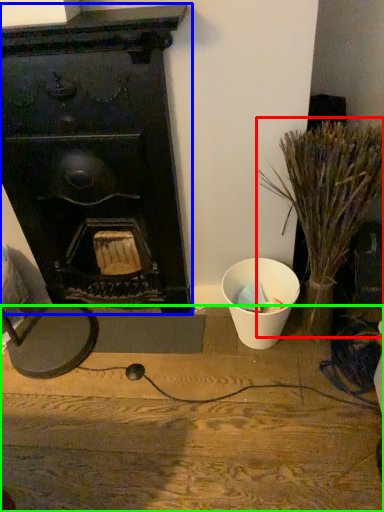
Question: Considering the real-world distances, which object is closest to plant (highlighted by a red box)? fireplace (highlighted by a blue box) or furniture (highlighted by a green box).

Choices:
 (A) fireplace
 (B) furniture

Answer: (A)